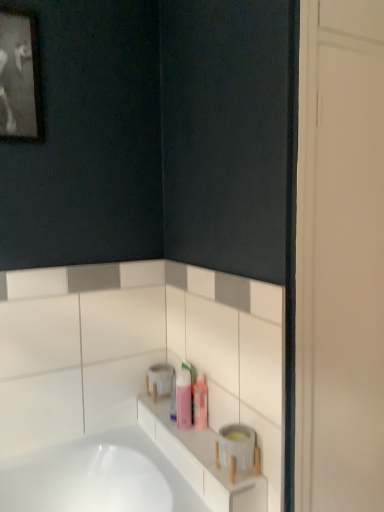
Question: In terms of size, does translucent plastic containers at lower center appear bigger or smaller than black matte picture frame at upper left?

Choices:
 (A) big
 (B) small

Answer: (B)

Question: Does point (218, 505) appear closer or farther from the camera than point (16, 53)?

Choices:
 (A) closer
 (B) farther

Answer: (A)

Question: Estimate the real-world distances between objects in this image. Which object is closer to the black matte picture frame at upper left?

Choices:
 (A) pink plastic bottle at center
 (B) translucent plastic containers at lower center
 (C) white matte toilet paper at upper center

Answer: (C)

Question: Which object is the farthest from the white matte toilet paper at upper center?

Choices:
 (A) translucent plastic containers at lower center
 (B) pink plastic bottle at center
 (C) black matte picture frame at upper left

Answer: (C)